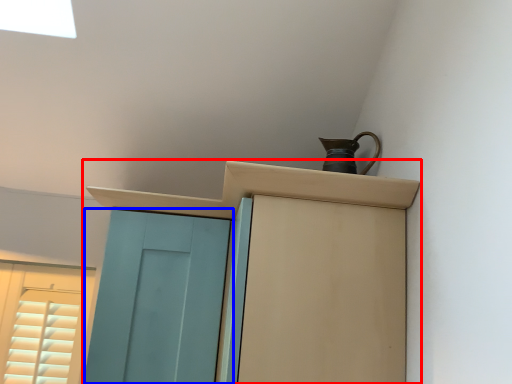
Question: Which object appears closest to the camera in this image, cupboard (highlighted by a red box) or door (highlighted by a blue box)?

Choices:
 (A) cupboard
 (B) door

Answer: (A)